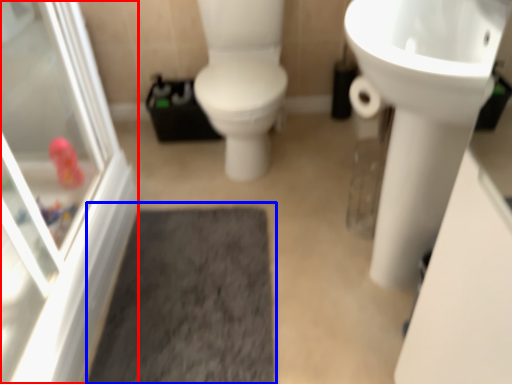
Question: Which of the following is the farthest to the observer, screen door (highlighted by a red box) or bath mat (highlighted by a blue box)?

Choices:
 (A) screen door
 (B) bath mat

Answer: (B)